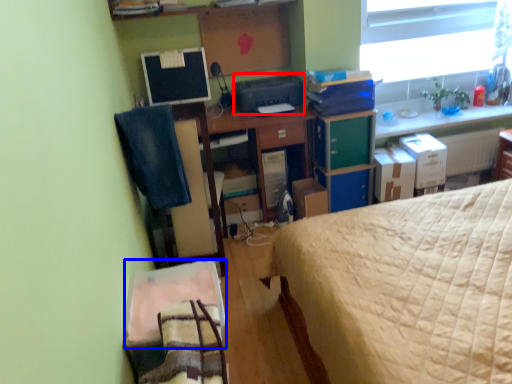
Question: Which point is closer to the camera, printer (highlighted by a red box) or sheet (highlighted by a blue box)?

Choices:
 (A) printer
 (B) sheet

Answer: (B)